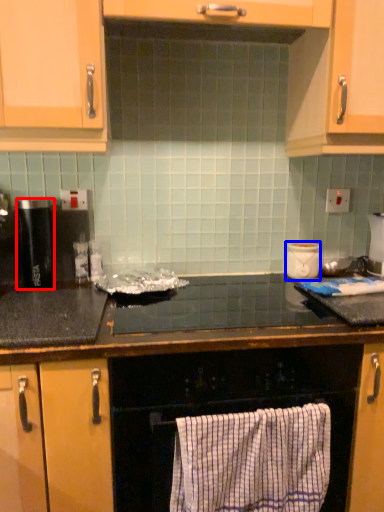
Question: Which object is further to the camera taking this photo, kitchen appliance (highlighted by a red box) or appliance (highlighted by a blue box)?

Choices:
 (A) kitchen appliance
 (B) appliance

Answer: (B)